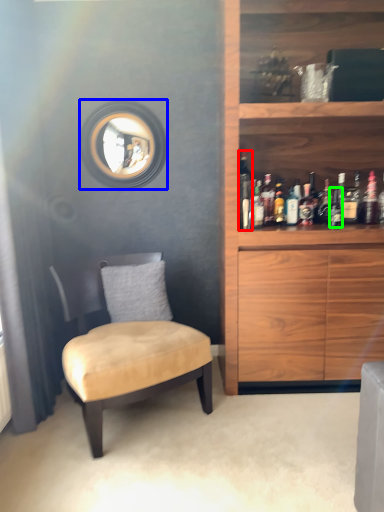
Question: Which object is positioned closest to bottle (highlighted by a red box)? Select from mirror (highlighted by a blue box) and bottle (highlighted by a green box).

Choices:
 (A) mirror
 (B) bottle

Answer: (B)